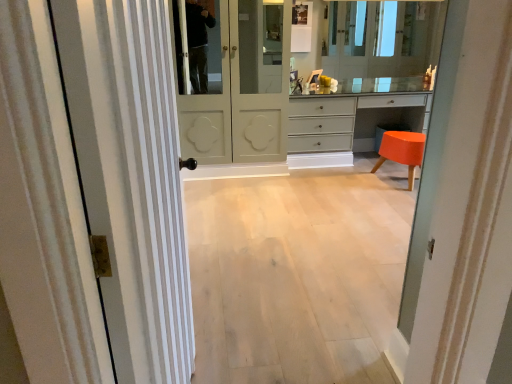
Question: Can you confirm if matte gray chest of drawers at center is positioned to the right of matte white door at center, which appears as the first door when viewed from the right?

Choices:
 (A) yes
 (B) no

Answer: (A)

Question: Considering the relative sizes of matte gray chest of drawers at center and matte white door at center, arranged as the first door when viewed from the back, in the image provided, is matte gray chest of drawers at center smaller than matte white door at center, arranged as the first door when viewed from the back,?

Choices:
 (A) yes
 (B) no

Answer: (A)

Question: Is matte gray chest of drawers at center facing towards matte white door at center, which appears as the first door when viewed from the right?

Choices:
 (A) yes
 (B) no

Answer: (B)

Question: From a real-world perspective, is matte gray chest of drawers at center positioned under matte white door at center, which is counted as the 2th door, starting from the left, based on gravity?

Choices:
 (A) no
 (B) yes

Answer: (B)

Question: Can you confirm if matte gray chest of drawers at center is shorter than matte white door at center, which is the second door from front to back?

Choices:
 (A) no
 (B) yes

Answer: (B)

Question: Considering the positions of clear glass mirror at upper center and light wood floor at center in the image, is clear glass mirror at upper center taller or shorter than light wood floor at center?

Choices:
 (A) short
 (B) tall

Answer: (B)

Question: Looking at the image, does clear glass mirror at upper center seem bigger or smaller compared to light wood floor at center?

Choices:
 (A) big
 (B) small

Answer: (B)

Question: From the image's perspective, is clear glass mirror at upper center above or below light wood floor at center?

Choices:
 (A) below
 (B) above

Answer: (B)

Question: Based on their positions, is clear glass mirror at upper center located to the left or right of light wood floor at center?

Choices:
 (A) right
 (B) left

Answer: (A)

Question: From a real-world perspective, is white striped door at left, acting as the 2th door starting from the right, physically located above or below matte gray chest of drawers at center?

Choices:
 (A) above
 (B) below

Answer: (A)

Question: From the image's perspective, is white striped door at left, arranged as the 1th door when viewed from the left, located above or below matte gray chest of drawers at center?

Choices:
 (A) above
 (B) below

Answer: (B)

Question: Is white striped door at left, arranged as the 1th door when viewed from the left, to the left or to the right of matte gray chest of drawers at center in the image?

Choices:
 (A) right
 (B) left

Answer: (B)

Question: In the image, is white striped door at left, which is the second door from back to front, positioned in front of or behind matte gray chest of drawers at center?

Choices:
 (A) front
 (B) behind

Answer: (A)

Question: In the image, is white striped door at left, arranged as the 1th door when viewed from the left, positioned in front of or behind orange glossy stool at lower right?

Choices:
 (A) front
 (B) behind

Answer: (A)

Question: Is white striped door at left, which is the second door from back to front, inside the boundaries of orange glossy stool at lower right, or outside?

Choices:
 (A) outside
 (B) inside

Answer: (A)